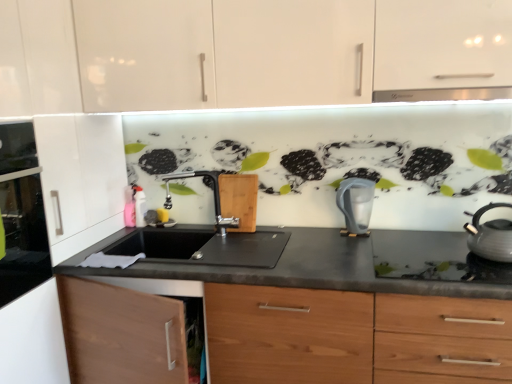
This screenshot has width=512, height=384. Find the location of `free space that is to the left of translucent plastic pitcher at center, the first kitchen appliance from the back`. free space that is to the left of translucent plastic pitcher at center, the first kitchen appliance from the back is located at coordinates (312, 235).